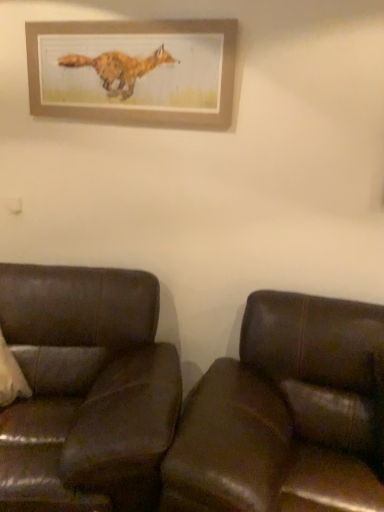
Where is `brown leather couch at left, the 2th studio couch from the right`? The width and height of the screenshot is (384, 512). brown leather couch at left, the 2th studio couch from the right is located at coordinates [x=86, y=390].

Image resolution: width=384 pixels, height=512 pixels. Describe the element at coordinates (86, 390) in the screenshot. I see `brown leather couch at left, the 2th studio couch from the right` at that location.

What is the approximate width of wooden picture frame at upper center?

It is 1.90 inches.

Where is `brown leather couch at left, the 2th studio couch from the right`? Image resolution: width=384 pixels, height=512 pixels. brown leather couch at left, the 2th studio couch from the right is located at coordinates (86, 390).

From the picture: Does brown leather couch at lower right, marked as the 1th studio couch in a right-to-left arrangement, appear on the left side of wooden picture frame at upper center?

Incorrect, brown leather couch at lower right, marked as the 1th studio couch in a right-to-left arrangement, is not on the left side of wooden picture frame at upper center.

From a real-world perspective, is brown leather couch at lower right, the second studio couch when ordered from left to right, physically below wooden picture frame at upper center?

Yes, from a real-world perspective, brown leather couch at lower right, the second studio couch when ordered from left to right, is under wooden picture frame at upper center.

Which is nearer, [53,280] or [101,35]?

Clearly, point [53,280] is more distant from the camera than point [101,35].

Is brown leather couch at left, which is the 1th studio couch from left to right, smaller than brown leather couch at lower right, marked as the 1th studio couch in a right-to-left arrangement?

No.

From a real-world perspective, is brown leather couch at left, the 2th studio couch from the right, located beneath brown leather couch at lower right, marked as the 1th studio couch in a right-to-left arrangement?

Correct, in the physical world, brown leather couch at left, the 2th studio couch from the right, is lower than brown leather couch at lower right, marked as the 1th studio couch in a right-to-left arrangement.

Does brown leather couch at left, the 2th studio couch from the right, have a greater height compared to brown leather couch at lower right, marked as the 1th studio couch in a right-to-left arrangement?

Incorrect, the height of brown leather couch at left, the 2th studio couch from the right, is not larger of that of brown leather couch at lower right, marked as the 1th studio couch in a right-to-left arrangement.

Could brown leather couch at lower right, the second studio couch when ordered from left to right, be considered to be inside brown leather couch at left, which is the 1th studio couch from left to right?

No.

Is the position of brown leather couch at lower right, the second studio couch when ordered from left to right, more distant than that of brown leather couch at left, which is the 1th studio couch from left to right?

No, the depth of brown leather couch at lower right, the second studio couch when ordered from left to right, is less than that of brown leather couch at left, which is the 1th studio couch from left to right.

Is brown leather couch at lower right, the second studio couch when ordered from left to right, far from brown leather couch at left, the 2th studio couch from the right?

They are positioned close to each other.

This screenshot has width=384, height=512. Find the location of `studio couch lying below the brown leather couch at left, which is the 1th studio couch from left to right (from the image's perspective)`. studio couch lying below the brown leather couch at left, which is the 1th studio couch from left to right (from the image's perspective) is located at coordinates (187, 403).

What's the angular difference between wooden picture frame at upper center and brown leather couch at lower right, marked as the 1th studio couch in a right-to-left arrangement,'s facing directions?

The facing directions of wooden picture frame at upper center and brown leather couch at lower right, marked as the 1th studio couch in a right-to-left arrangement, are 0.00508 degrees apart.

Identify the location of picture frame behind the brown leather couch at lower right, marked as the 1th studio couch in a right-to-left arrangement. (134, 71).

Is wooden picture frame at upper center bigger or smaller than brown leather couch at lower right, marked as the 1th studio couch in a right-to-left arrangement?

Clearly, wooden picture frame at upper center is smaller in size than brown leather couch at lower right, marked as the 1th studio couch in a right-to-left arrangement.

In terms of height, does wooden picture frame at upper center look taller or shorter compared to brown leather couch at left, which is the 1th studio couch from left to right?

wooden picture frame at upper center is shorter than brown leather couch at left, which is the 1th studio couch from left to right.

In the image, is wooden picture frame at upper center positioned in front of or behind brown leather couch at left, the 2th studio couch from the right?

wooden picture frame at upper center is positioned farther from the viewer than brown leather couch at left, the 2th studio couch from the right.

Is wooden picture frame at upper center located outside brown leather couch at left, the 2th studio couch from the right?

wooden picture frame at upper center is positioned outside brown leather couch at left, the 2th studio couch from the right.

Are brown leather couch at left, which is the 1th studio couch from left to right, and wooden picture frame at upper center far apart?

brown leather couch at left, which is the 1th studio couch from left to right, is positioned a significant distance from wooden picture frame at upper center.

Which is behind, point (150, 484) or point (229, 122)?

The point (229, 122) is behind.

From a real-world perspective, is brown leather couch at left, which is the 1th studio couch from left to right, physically above wooden picture frame at upper center?

No, from a real-world perspective, brown leather couch at left, which is the 1th studio couch from left to right, is not above wooden picture frame at upper center.

Identify the location of picture frame behind the brown leather couch at lower right, marked as the 1th studio couch in a right-to-left arrangement. This screenshot has height=512, width=384. (134, 71).

Where is `studio couch below the brown leather couch at lower right, the second studio couch when ordered from left to right (from a real-world perspective)`? The width and height of the screenshot is (384, 512). studio couch below the brown leather couch at lower right, the second studio couch when ordered from left to right (from a real-world perspective) is located at coordinates (86, 390).

Considering their positions, is wooden picture frame at upper center positioned closer to brown leather couch at left, the 2th studio couch from the right, than brown leather couch at lower right, the second studio couch when ordered from left to right?

brown leather couch at lower right, the second studio couch when ordered from left to right, is positioned closer to the anchor brown leather couch at left, the 2th studio couch from the right.

Estimate the real-world distances between objects in this image. Which object is closer to wooden picture frame at upper center, brown leather couch at left, which is the 1th studio couch from left to right, or brown leather couch at lower right, the second studio couch when ordered from left to right?

brown leather couch at left, which is the 1th studio couch from left to right, is closer to wooden picture frame at upper center.

Estimate the real-world distances between objects in this image. Which object is further from brown leather couch at lower right, marked as the 1th studio couch in a right-to-left arrangement, brown leather couch at left, which is the 1th studio couch from left to right, or wooden picture frame at upper center?

Among the two, wooden picture frame at upper center is located further to brown leather couch at lower right, marked as the 1th studio couch in a right-to-left arrangement.

When comparing their distances from brown leather couch at lower right, the second studio couch when ordered from left to right, does wooden picture frame at upper center or brown leather couch at left, which is the 1th studio couch from left to right, seem closer?

brown leather couch at left, which is the 1th studio couch from left to right, lies closer to brown leather couch at lower right, the second studio couch when ordered from left to right, than the other object.

In the scene shown: When comparing their distances from brown leather couch at left, the 2th studio couch from the right, does brown leather couch at lower right, the second studio couch when ordered from left to right, or wooden picture frame at upper center seem further?

wooden picture frame at upper center is positioned further to the anchor brown leather couch at left, the 2th studio couch from the right.

When comparing their distances from wooden picture frame at upper center, does brown leather couch at lower right, the second studio couch when ordered from left to right, or brown leather couch at left, which is the 1th studio couch from left to right, seem closer?

brown leather couch at left, which is the 1th studio couch from left to right, is positioned closer to the anchor wooden picture frame at upper center.

Identify the location of studio couch between wooden picture frame at upper center and brown leather couch at lower right, the second studio couch when ordered from left to right, from top to bottom. (86, 390).